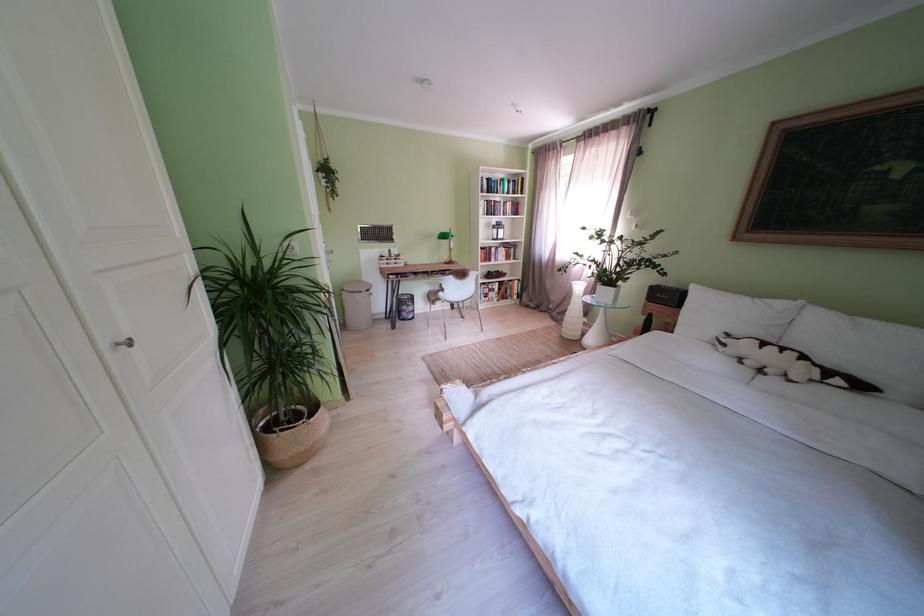
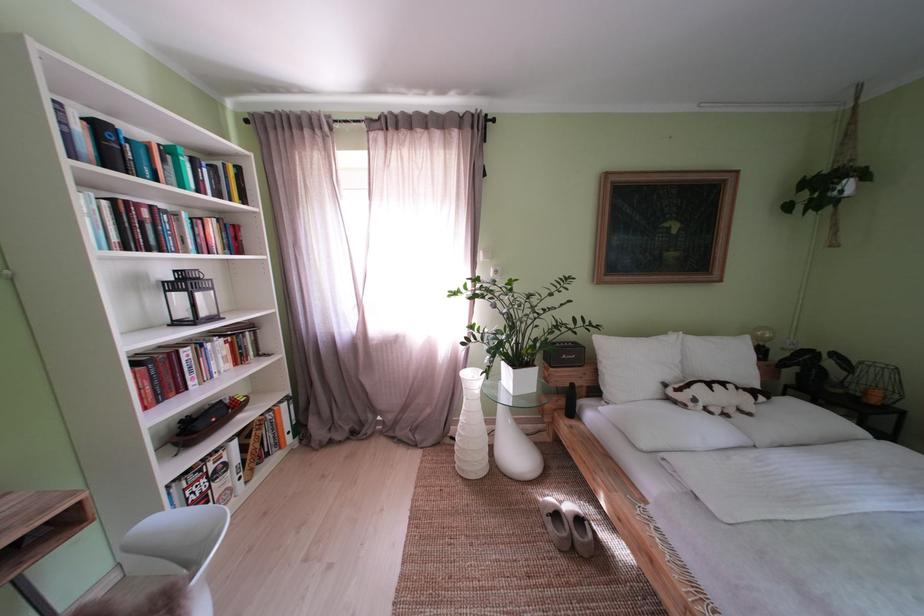
Find the pixel in the second image that matches (500,185) in the first image.

(111, 132)